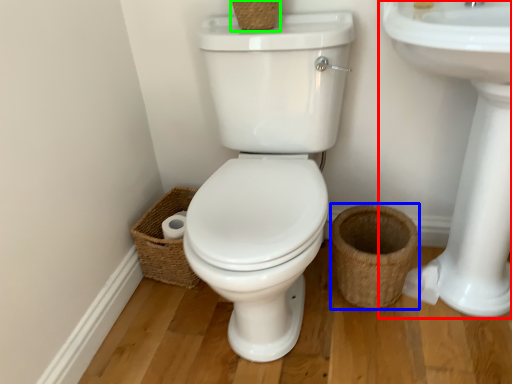
Question: Estimate the real-world distances between objects in this image. Which object is farther from sink (highlighted by a red box), basket (highlighted by a blue box) or basket (highlighted by a green box)?

Choices:
 (A) basket
 (B) basket

Answer: (B)